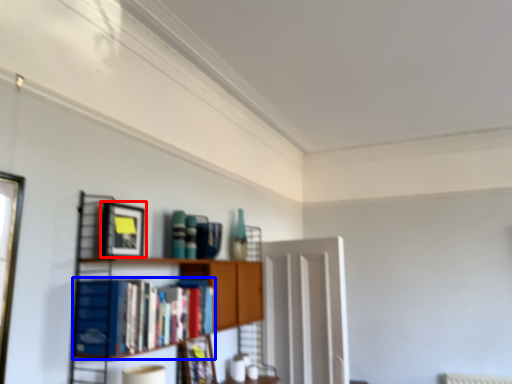
Question: Which point is further to the camera, picture frame (highlighted by a red box) or book (highlighted by a blue box)?

Choices:
 (A) picture frame
 (B) book

Answer: (A)